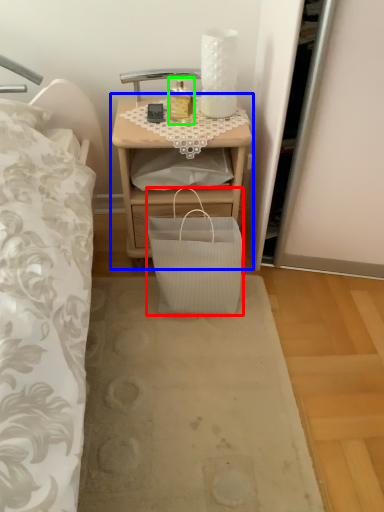
Question: Which object is positioned closest to bag (highlighted by a red box)? Select from nightstand (highlighted by a blue box) and bottle (highlighted by a green box).

Choices:
 (A) nightstand
 (B) bottle

Answer: (A)